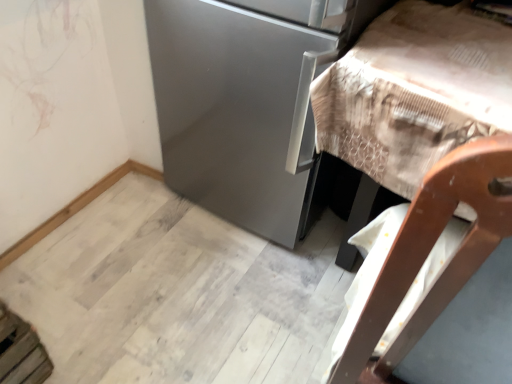
Question: Does wooden chair at right have a greater height compared to satin silver refrigerator at center?

Choices:
 (A) no
 (B) yes

Answer: (A)

Question: Would you consider wooden chair at right to be distant from satin silver refrigerator at center?

Choices:
 (A) yes
 (B) no

Answer: (B)

Question: Does wooden chair at right have a smaller size compared to satin silver refrigerator at center?

Choices:
 (A) yes
 (B) no

Answer: (A)

Question: Does wooden chair at right have a larger size compared to satin silver refrigerator at center?

Choices:
 (A) no
 (B) yes

Answer: (A)

Question: Is wooden chair at right closer to the viewer compared to satin silver refrigerator at center?

Choices:
 (A) no
 (B) yes

Answer: (B)

Question: Is satin silver refrigerator at center at the back of wooden chair at right?

Choices:
 (A) no
 (B) yes

Answer: (A)

Question: Is satin silver refrigerator at center smaller than wooden chair at right?

Choices:
 (A) yes
 (B) no

Answer: (B)

Question: Is satin silver refrigerator at center shorter than wooden chair at right?

Choices:
 (A) yes
 (B) no

Answer: (B)

Question: Is satin silver refrigerator at center at the right side of wooden chair at right?

Choices:
 (A) no
 (B) yes

Answer: (A)

Question: Is wooden chair at right located within satin silver refrigerator at center?

Choices:
 (A) yes
 (B) no

Answer: (B)

Question: Is the position of satin silver refrigerator at center less distant than that of wooden chair at right?

Choices:
 (A) no
 (B) yes

Answer: (A)

Question: Is satin silver refrigerator at center touching wooden chair at right?

Choices:
 (A) yes
 (B) no

Answer: (B)

Question: From the image's perspective, is satin silver refrigerator at center located above or below wooden chair at right?

Choices:
 (A) below
 (B) above

Answer: (B)